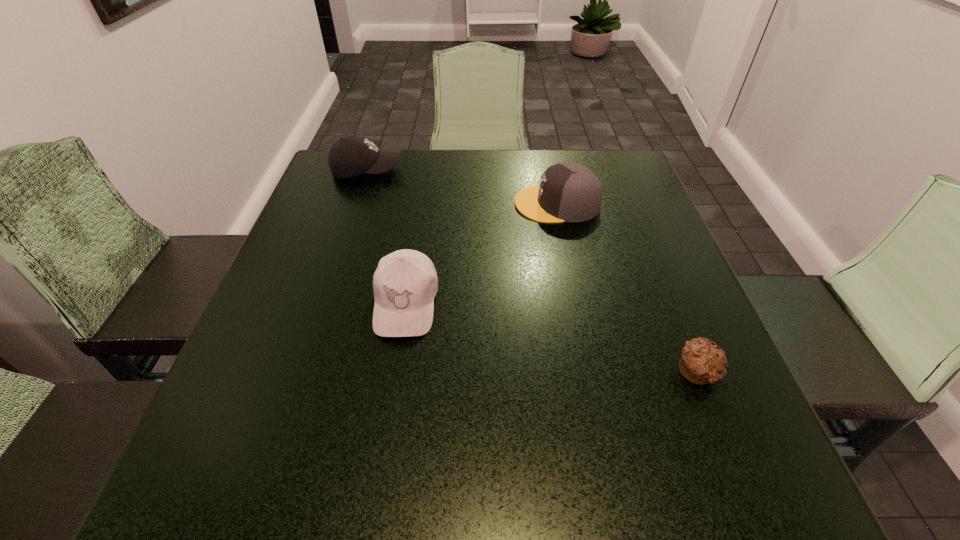
The width and height of the screenshot is (960, 540). I want to click on object that is positioned at the far right corner, so click(x=568, y=192).

Identify the location of vacant space at the far edge of the desktop. (457, 168).

I want to click on vacant space at the near edge of the desktop, so click(547, 485).

I want to click on vacant space at the left edge, so click(x=367, y=222).

The height and width of the screenshot is (540, 960). What are the coordinates of `blank space at the right edge of the desktop` in the screenshot? It's located at (630, 243).

You are a GUI agent. You are given a task and a screenshot of the screen. Output one action in this format:
    pyautogui.click(x=<x>, y=<y>)
    Task: Click on the vacant space at the far left corner of the desktop
    The image size is (960, 540).
    Given the screenshot: What is the action you would take?
    pyautogui.click(x=366, y=183)

This screenshot has height=540, width=960. I want to click on vacant position at the far right corner of the desktop, so click(x=608, y=157).

Identify the location of free area in between the farther baseball cap and the second nearest object. The width and height of the screenshot is (960, 540). (386, 237).

Locate an element on the screen. This screenshot has height=540, width=960. free area in between the left baseball cap and the right baseball cap is located at coordinates (386, 237).

Locate an element on the screen. vacant space that is in between the third object from left to right and the third object from right to left is located at coordinates (481, 253).